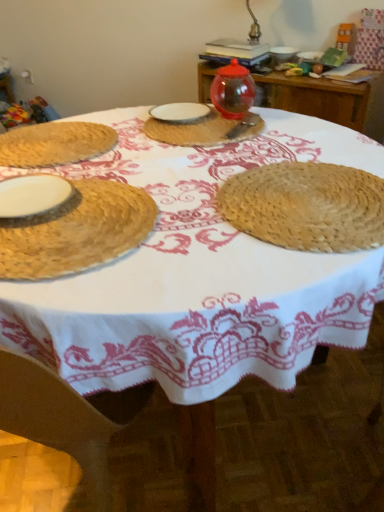
Question: Would you say white ceramic plate at center, positioned as the third tableware in top-to-bottom order, is inside or outside white matte plate at left, which is the 4th tableware in back-to-front order?

Choices:
 (A) outside
 (B) inside

Answer: (A)

Question: Visually, is white ceramic plate at center, positioned as the third tableware in top-to-bottom order, positioned to the left or to the right of white matte plate at left, which is the 4th tableware in back-to-front order?

Choices:
 (A) left
 (B) right

Answer: (B)

Question: Which of these objects is positioned closest to the natural straw placemat at left, which is the 5th tableware in back-to-front order?

Choices:
 (A) white ceramic plate at center, acting as the third tableware starting from the bottom
 (B) matte wicker placemat at center
 (C) transparent glass jar at upper center, which is the 1th tableware in back-to-front order
 (D) transparent glass jar at upper center, which is the third tableware from front to back
 (E) woven straw placemat at left, which ranks as the 1th table in left-to-right order

Answer: (E)

Question: Considering the real-world distances, which object is closest to the natural straw placemat at center?

Choices:
 (A) white matte plate at left, the second tableware when ordered from bottom to top
 (B) transparent glass jar at upper center, the 4th tableware ordered from the bottom
 (C) matte wicker placemat at center
 (D) transparent glass jar at upper center, arranged as the 1th table when viewed from the back
 (E) woven straw placemat at left, which is counted as the first table, starting from the bottom

Answer: (C)